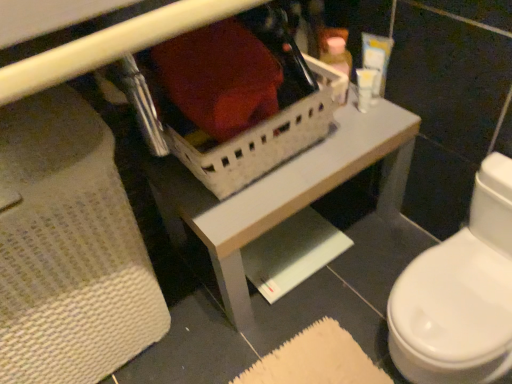
Where is `free region on the left part of white plastic container at upper right, the 2th toiletry when ordered from right to left`? The width and height of the screenshot is (512, 384). free region on the left part of white plastic container at upper right, the 2th toiletry when ordered from right to left is located at coordinates (323, 139).